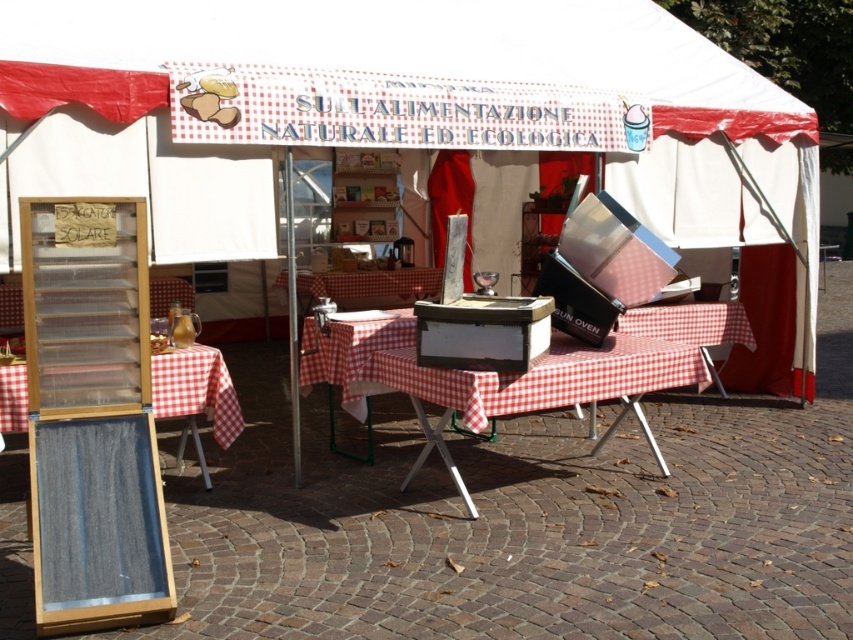
Which is more to the left, denim board at lower left or wooden chair at lower left?

From the viewer's perspective, wooden chair at lower left appears more on the left side.

Who is positioned more to the right, denim board at lower left or wooden chair at lower left?

Positioned to the right is denim board at lower left.

I want to click on denim board at lower left, so click(195, 394).

Can you confirm if checkered fabric picnic table at center is wider than denim board at lower left?

Yes.

Is checkered fabric picnic table at center positioned in front of denim board at lower left?

That is True.

Which is in front, point (392, 317) or point (218, 374)?

Positioned in front is point (218, 374).

Image resolution: width=853 pixels, height=640 pixels. What are the coordinates of `checkered fabric picnic table at center` in the screenshot? It's located at (523, 372).

Is point (495, 394) closer to viewer compared to point (152, 308)?

Yes.

Does checkered fabric picnic table at center have a smaller size compared to wooden chair at lower left?

Actually, checkered fabric picnic table at center might be larger than wooden chair at lower left.

Is point (683, 305) in front of point (154, 316)?

Yes, it is in front of point (154, 316).

Locate an element on the screen. Image resolution: width=853 pixels, height=640 pixels. checkered fabric picnic table at center is located at coordinates (523, 372).